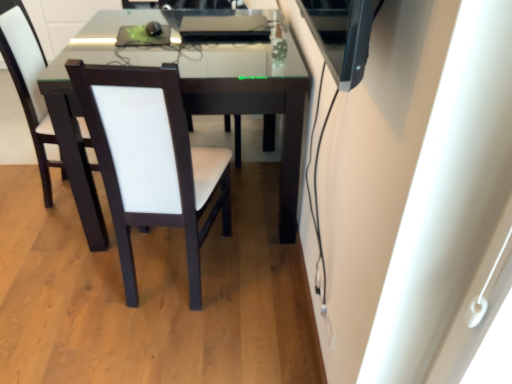
Question: From the image's perspective, is white leather chair at center, which ranks as the 2th chair in right-to-left order, above or below white leather chair at center, which appears as the 1th chair when viewed from the left?

Choices:
 (A) above
 (B) below

Answer: (B)

Question: Is white leather chair at center, which ranks as the 2th chair in right-to-left order, bigger or smaller than white leather chair at center, the third chair in the right-to-left sequence?

Choices:
 (A) big
 (B) small

Answer: (A)

Question: Based on their relative distances, which object is nearer to the white leather chair at center, which is counted as the 3th chair, starting from the left?

Choices:
 (A) white leather chair at center, the 2th chair in the left-to-right sequence
 (B) white leather chair at center, which appears as the 1th chair when viewed from the left

Answer: (B)

Question: Considering the real-world distances, which object is closest to the white leather chair at center, the 2th chair in the left-to-right sequence?

Choices:
 (A) white leather chair at center, which is counted as the 3th chair, starting from the left
 (B) white leather chair at center, which appears as the 1th chair when viewed from the left

Answer: (A)